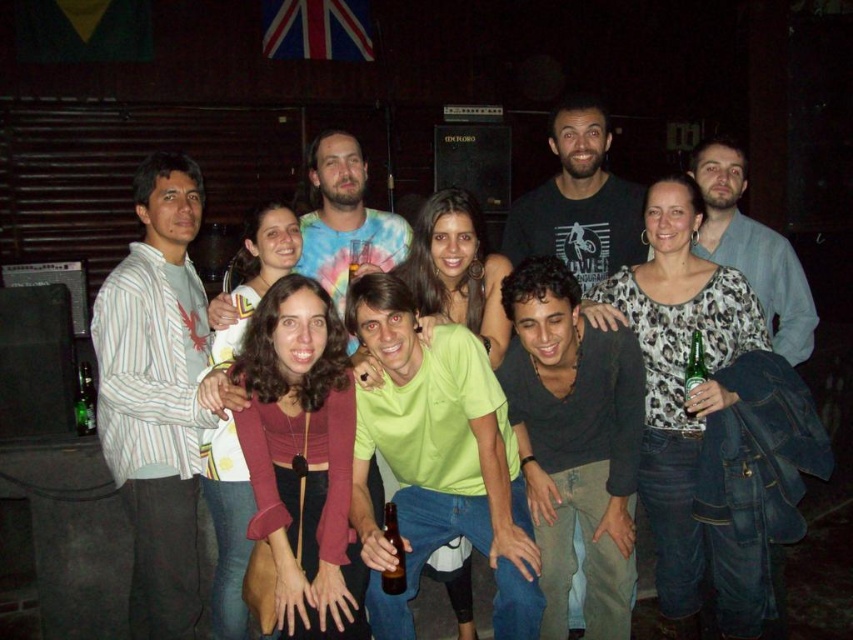
You are taking a photo of the group and need to focus on two specific points in the image. The first point is at coordinate point (437, 497) and the second is at coordinate point (79, 371). Which point should you focus on to ensure the foreground is sharp?

Point (437, 497) is closer to the camera than point (79, 371), so focusing on point (437, 497) will ensure the foreground is sharp.

You are a bartender who needs to place a new bottle between the brown glass bottle at center and the green glass bottle at center. The new bottle is 1.5 feet wide. Can you fit it between them?

The distance between the brown glass bottle at center and the green glass bottle at center is 3.68 feet. Since the new bottle is 1.5 feet wide, there is enough space to place it between them as 3.68 feet is greater than 1.5 feet.

You are at a bar and need to place a coaster under the brown glass bottle at center and the green glass bottle at center. Which bottle requires a larger coaster to prevent it from tipping over?

The brown glass bottle at center requires a larger coaster because it might be wider than the green glass bottle at center, making it less stable and needing more surface area to prevent tipping.